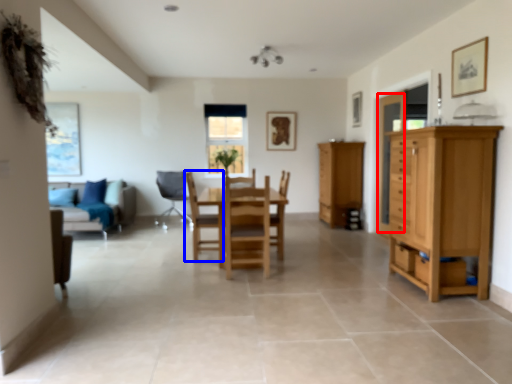
Question: Which object is closer to the camera taking this photo, glass door (highlighted by a red box) or chair (highlighted by a blue box)?

Choices:
 (A) glass door
 (B) chair

Answer: (B)